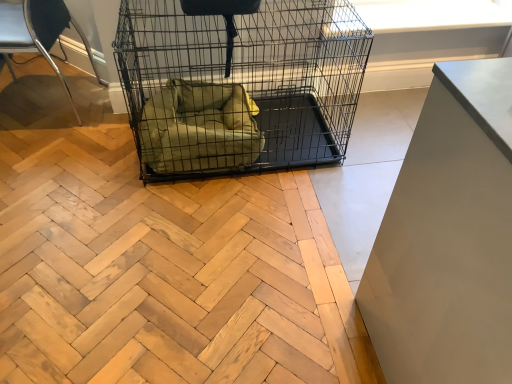
Question: From the image's perspective, is green fabric dog bed at center under black wire mesh cage at center?

Choices:
 (A) yes
 (B) no

Answer: (A)

Question: From a real-world perspective, is green fabric dog bed at center on top of black wire mesh cage at center?

Choices:
 (A) no
 (B) yes

Answer: (A)

Question: From the image's perspective, is green fabric dog bed at center on top of black wire mesh cage at center?

Choices:
 (A) yes
 (B) no

Answer: (B)

Question: Can you confirm if green fabric dog bed at center is smaller than black wire mesh cage at center?

Choices:
 (A) no
 (B) yes

Answer: (B)

Question: Considering the relative sizes of green fabric dog bed at center and black wire mesh cage at center in the image provided, is green fabric dog bed at center wider than black wire mesh cage at center?

Choices:
 (A) yes
 (B) no

Answer: (B)

Question: Does green fabric dog bed at center have a larger size compared to black wire mesh cage at center?

Choices:
 (A) no
 (B) yes

Answer: (A)

Question: Can you confirm if black wire mesh cage at center is bigger than green fabric dog bed at center?

Choices:
 (A) no
 (B) yes

Answer: (B)

Question: Is black wire mesh cage at center located outside green fabric dog bed at center?

Choices:
 (A) yes
 (B) no

Answer: (A)

Question: Does black wire mesh cage at center have a smaller size compared to green fabric dog bed at center?

Choices:
 (A) no
 (B) yes

Answer: (A)

Question: Is black wire mesh cage at center at the right side of green fabric dog bed at center?

Choices:
 (A) yes
 (B) no

Answer: (A)

Question: Does black wire mesh cage at center have a lesser height compared to green fabric dog bed at center?

Choices:
 (A) no
 (B) yes

Answer: (A)

Question: From a real-world perspective, is black wire mesh cage at center physically above green fabric dog bed at center?

Choices:
 (A) yes
 (B) no

Answer: (A)

Question: Can you confirm if metallic silver chair at left is positioned to the left of green fabric dog bed at center?

Choices:
 (A) yes
 (B) no

Answer: (A)